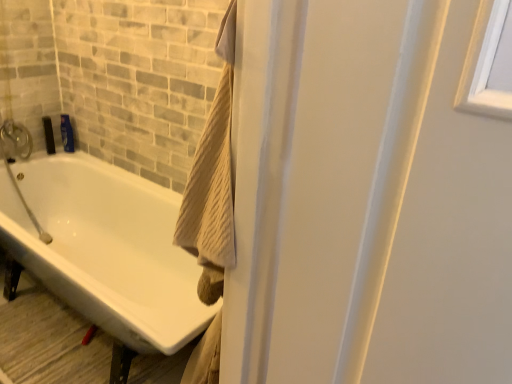
Question: In terms of width, does blue glossy shampoo bottle at upper left look wider or thinner when compared to white glossy bathtub at lower left?

Choices:
 (A) thin
 (B) wide

Answer: (A)

Question: Is blue glossy shampoo bottle at upper left to the left or to the right of white glossy bathtub at lower left in the image?

Choices:
 (A) left
 (B) right

Answer: (A)

Question: In the image, is blue glossy shampoo bottle at upper left positioned in front of or behind white glossy bathtub at lower left?

Choices:
 (A) front
 (B) behind

Answer: (B)

Question: Looking at their shapes, would you say white glossy bathtub at lower left is wider or thinner than blue glossy shampoo bottle at upper left?

Choices:
 (A) wide
 (B) thin

Answer: (A)

Question: Is white glossy bathtub at lower left in front of or behind blue glossy shampoo bottle at upper left in the image?

Choices:
 (A) behind
 (B) front

Answer: (B)

Question: Considering the relative positions of white glossy bathtub at lower left and blue glossy shampoo bottle at upper left in the image provided, is white glossy bathtub at lower left to the left or to the right of blue glossy shampoo bottle at upper left?

Choices:
 (A) left
 (B) right

Answer: (B)

Question: Is point (170, 311) positioned closer to the camera than point (65, 135)?

Choices:
 (A) closer
 (B) farther

Answer: (A)